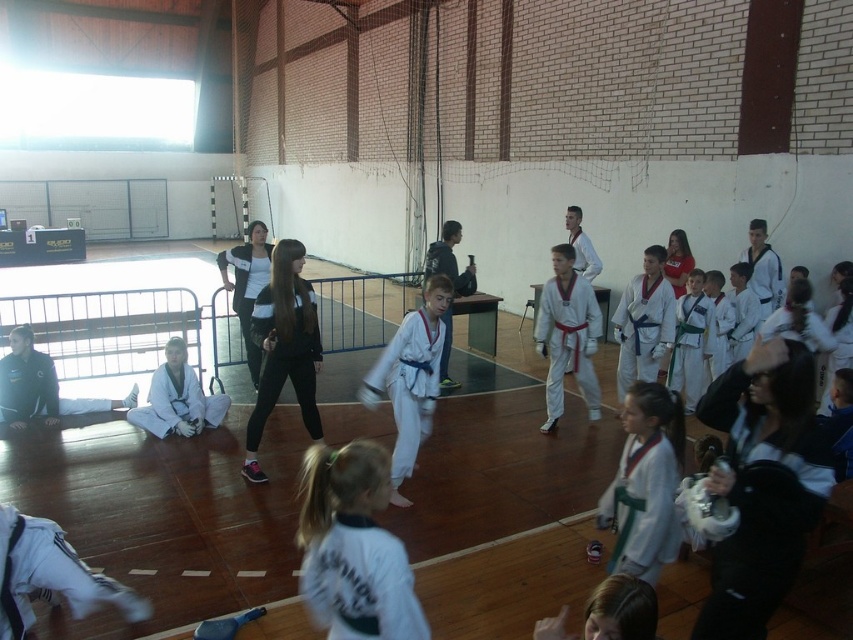
You are a new student entering the dojo and see the black matte jacket at center and the white karate uniform at center. Which one is closer to you?

The black matte jacket at center is closer to you because the white karate uniform at center is behind it.